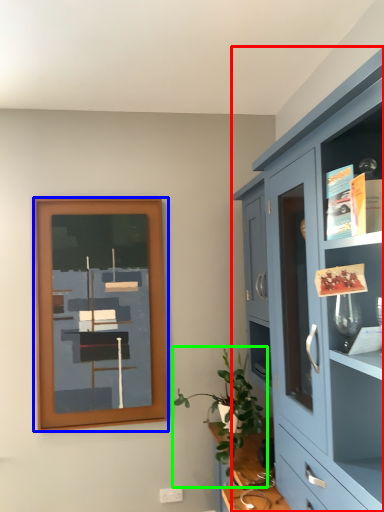
Question: Which object is positioned farthest from cabinetry (highlighted by a red box)? Select from picture frame (highlighted by a blue box) and houseplant (highlighted by a green box).

Choices:
 (A) picture frame
 (B) houseplant

Answer: (A)